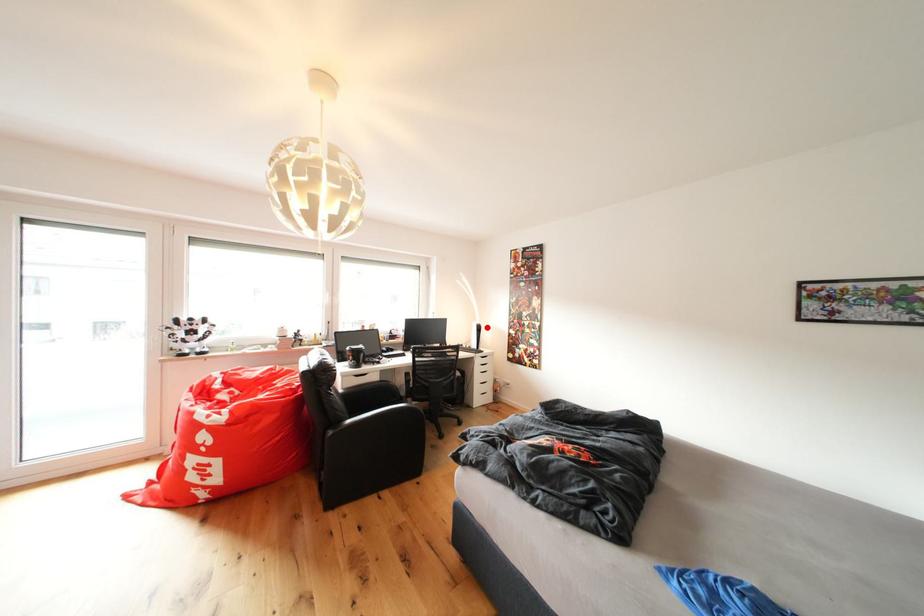
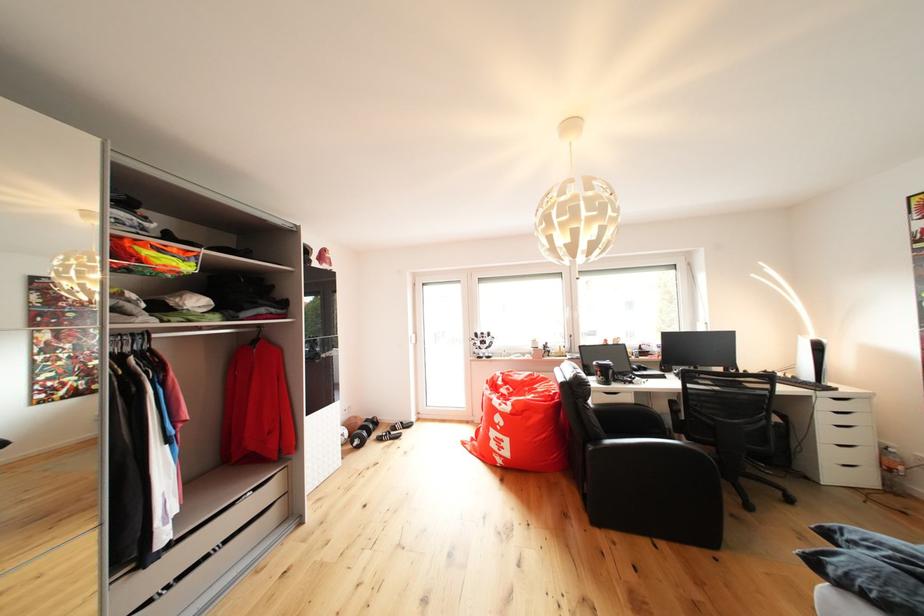
Question: I am providing you with two images of the same scene from different viewpoints. In image1, a red point is highlighted. Considering the same 3D point in image2, which of the following is correct?

Choices:
 (A) It is closer
 (B) It is farther

Answer: (A)